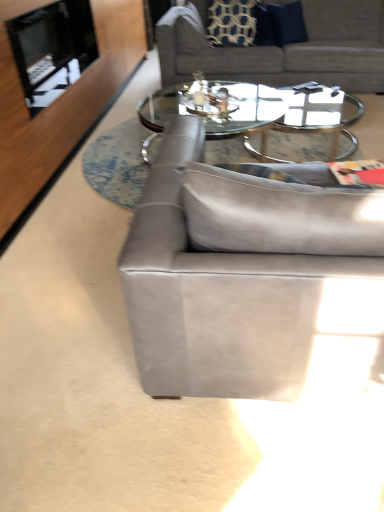
Question: From the image's perspective, is suede gray couch at upper center, which is the first studio couch in back-to-front order, located above or below clear glass coffee table at center?

Choices:
 (A) above
 (B) below

Answer: (A)

Question: Is suede gray couch at upper center, which is the first studio couch in back-to-front order, bigger or smaller than clear glass coffee table at center?

Choices:
 (A) big
 (B) small

Answer: (A)

Question: Estimate the real-world distances between objects in this image. Which object is farther from the black glass fireplace at upper left?

Choices:
 (A) clear glass coffee table at center
 (B) suede gray couch at center, which appears as the 2th studio couch when viewed from the top
 (C) suede gray couch at upper center, which is the first studio couch in back-to-front order

Answer: (B)

Question: Which of these objects is positioned farthest from the black glass fireplace at upper left?

Choices:
 (A) suede gray couch at center, which appears as the 2th studio couch when viewed from the top
 (B) suede gray couch at upper center, which is the first studio couch in back-to-front order
 (C) clear glass coffee table at center

Answer: (A)